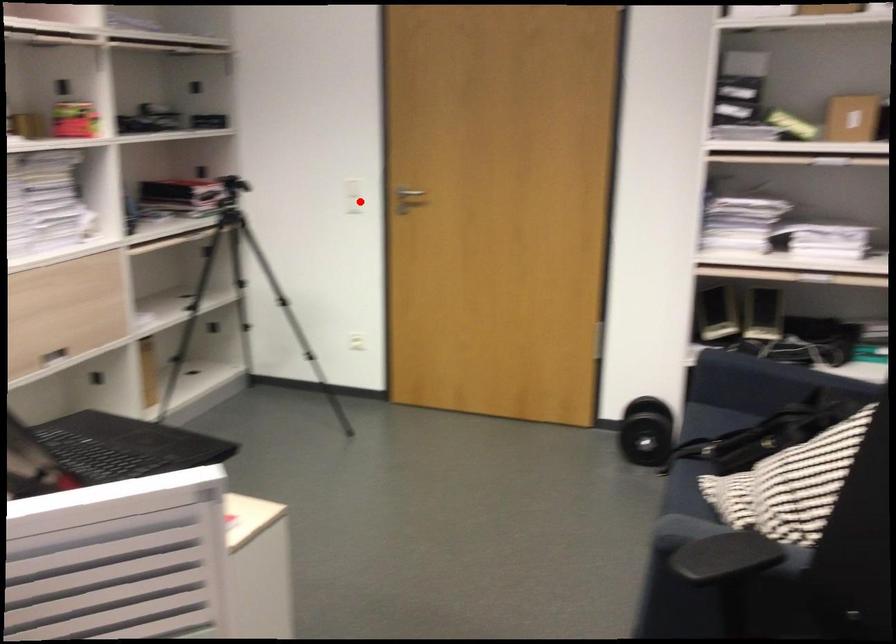
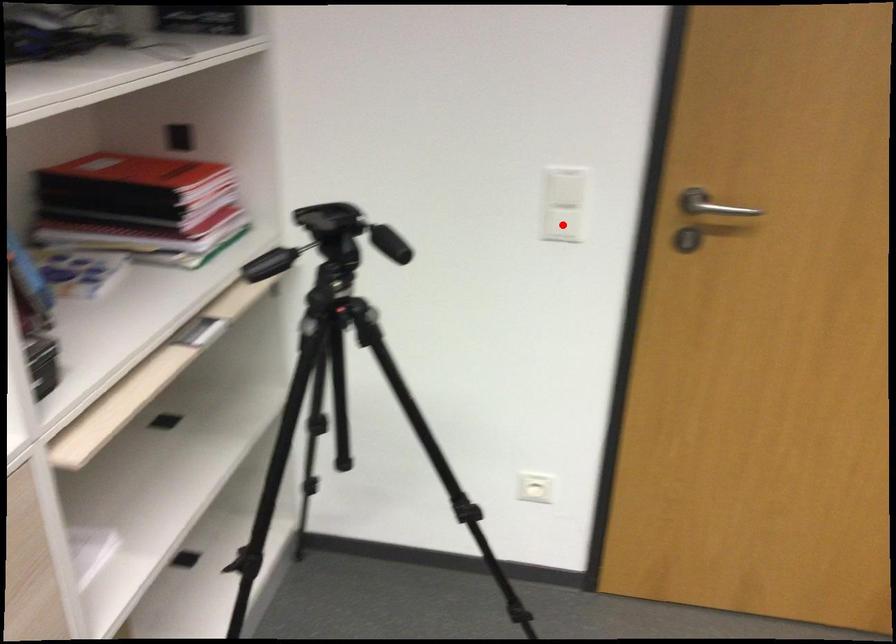
I am providing you with two images of the same scene from different viewpoints. A red point is marked on the first image and another point is marked on the second image. Is the marked point in image1 the same physical position as the marked point in image2?

Yes